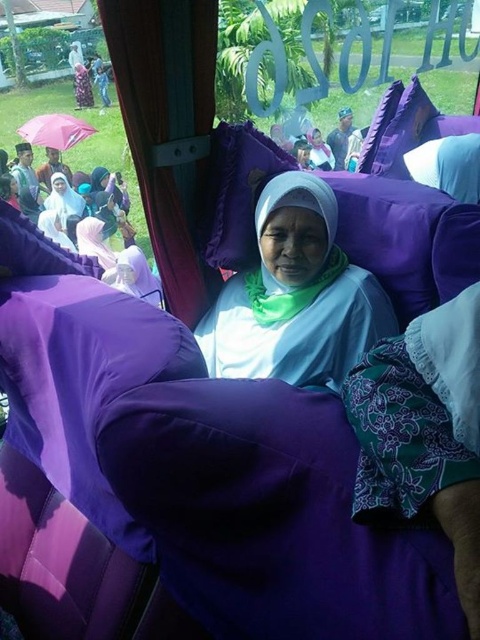
You are a passenger on the bus and want to know which of the two points, point (132, 134) or point (56, 227), is closer to you. Can you determine this based on the scene?

Point (132, 134) is closer to the viewer than point (56, 227).

You are a passenger on the bus and want to know which object is taller between the pink fabric umbrella at upper left and the matte purple hijab at center. Can you tell me?

The pink fabric umbrella at upper left is shorter than the matte purple hijab at center, so the matte purple hijab at center is taller.